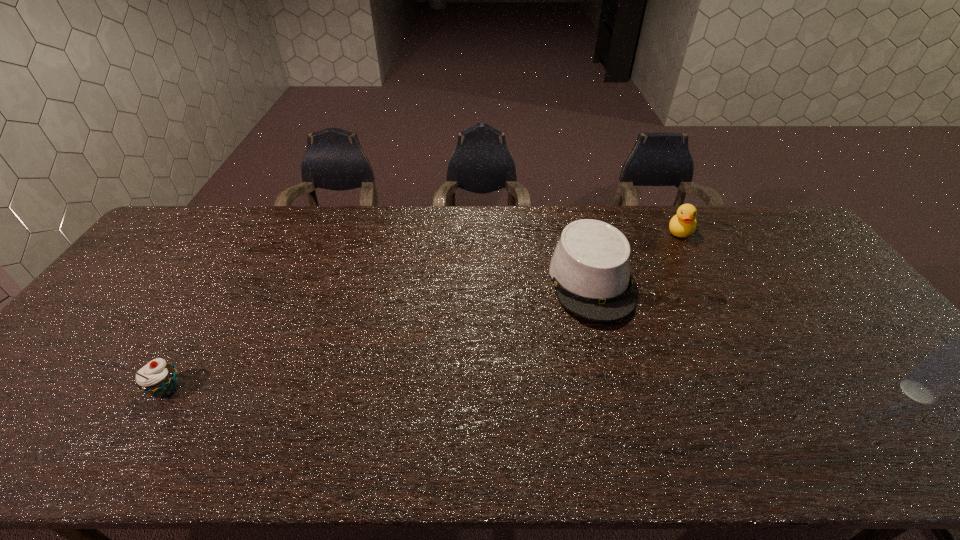
Where is `object that is at the near right corner`? object that is at the near right corner is located at coordinates (958, 360).

In the image, there is a desktop. Identify the location of vacant space at the far edge. The image size is (960, 540). (712, 238).

In the image, there is a desktop. Identify the location of free space at the near edge. This screenshot has width=960, height=540. click(x=124, y=416).

In the image, there is a desktop. At what (x,y) coordinates should I click in order to perform the action: click on vacant space at the left edge. Please return your answer as a coordinate pair (x, y). The image size is (960, 540). Looking at the image, I should click on (178, 275).

Identify the location of vacant space at the far right corner of the desktop. Image resolution: width=960 pixels, height=540 pixels. (765, 205).

Where is `vacant space that is in between the second object from left to right and the duckling`? The width and height of the screenshot is (960, 540). vacant space that is in between the second object from left to right and the duckling is located at coordinates (636, 256).

Find the location of a particular element. The height and width of the screenshot is (540, 960). free point between the duckling and the cupcake is located at coordinates (424, 310).

Locate an element on the screen. This screenshot has width=960, height=540. blank region between the leftmost object and the second object from left to right is located at coordinates (379, 335).

Locate an element on the screen. This screenshot has width=960, height=540. vacant area that lies between the duckling and the leftmost object is located at coordinates (424, 310).

Find the location of a particular element. empty location between the rightmost object and the second object from right to left is located at coordinates (799, 312).